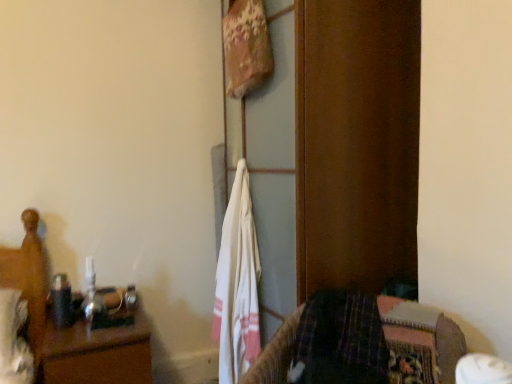
Question: Is wooden bed at left wider than plaid fabric bedspread at lower right?

Choices:
 (A) yes
 (B) no

Answer: (B)

Question: Is wooden bed at left at the right side of plaid fabric bedspread at lower right?

Choices:
 (A) no
 (B) yes

Answer: (A)

Question: Is wooden bed at left facing towards plaid fabric bedspread at lower right?

Choices:
 (A) yes
 (B) no

Answer: (B)

Question: Is wooden bed at left taller than plaid fabric bedspread at lower right?

Choices:
 (A) yes
 (B) no

Answer: (A)

Question: From a real-world perspective, is wooden bed at left located beneath plaid fabric bedspread at lower right?

Choices:
 (A) no
 (B) yes

Answer: (B)

Question: From a real-world perspective, is white cotton towel at center positioned above or below wooden nightstand at left?

Choices:
 (A) below
 (B) above

Answer: (B)

Question: Considering their positions, is white cotton towel at center located in front of or behind wooden nightstand at left?

Choices:
 (A) behind
 (B) front

Answer: (B)

Question: From the image's perspective, is white cotton towel at center located above or below wooden nightstand at left?

Choices:
 (A) above
 (B) below

Answer: (A)

Question: Looking at the image, does white cotton towel at center seem bigger or smaller compared to wooden nightstand at left?

Choices:
 (A) big
 (B) small

Answer: (B)

Question: In the image, is wooden nightstand at left on the left side or the right side of wooden bed at left?

Choices:
 (A) left
 (B) right

Answer: (B)

Question: Looking at their shapes, would you say wooden nightstand at left is wider or thinner than wooden bed at left?

Choices:
 (A) wide
 (B) thin

Answer: (A)

Question: Is wooden nightstand at left bigger or smaller than wooden bed at left?

Choices:
 (A) big
 (B) small

Answer: (A)

Question: From their relative heights in the image, would you say wooden nightstand at left is taller or shorter than wooden bed at left?

Choices:
 (A) short
 (B) tall

Answer: (A)

Question: Is white cotton towel at center bigger or smaller than plaid fabric bedspread at lower right?

Choices:
 (A) big
 (B) small

Answer: (B)

Question: Is white cotton towel at center inside the boundaries of plaid fabric bedspread at lower right, or outside?

Choices:
 (A) outside
 (B) inside

Answer: (A)